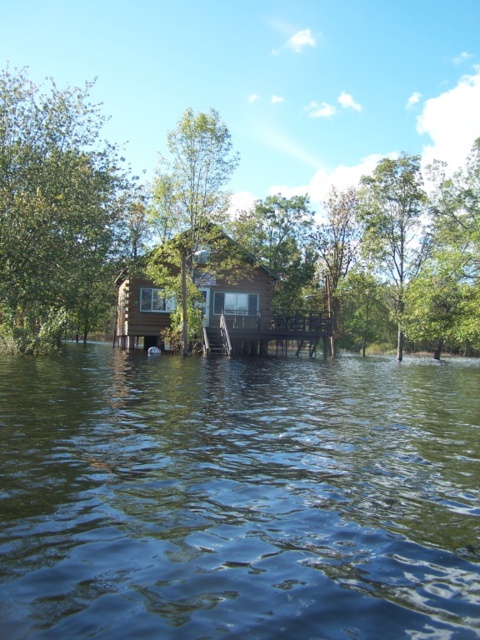
Does point (373, 579) come farther from viewer compared to point (21, 225)?

No, (373, 579) is in front of (21, 225).

In the scene shown: Can you confirm if green water at center is shorter than green wood tree at center?

Indeed, green water at center has a lesser height compared to green wood tree at center.

Is point (145, 566) closer to camera compared to point (377, 244)?

Yes.

This screenshot has width=480, height=640. Identify the location of green water at center. (238, 497).

Locate an element on the screen. green matte tree at center is located at coordinates (192, 179).

Does green matte tree at center have a lesser height compared to green leafy tree at upper right?

In fact, green matte tree at center may be taller than green leafy tree at upper right.

You are a GUI agent. You are given a task and a screenshot of the screen. Output one action in this format:
    pyautogui.click(x=<x>, y=<y>)
    Task: Click on the green matte tree at center
    The height and width of the screenshot is (640, 480).
    Given the screenshot: What is the action you would take?
    [192, 179]

Measure the distance from brown wooden cabin at center to green matte tree at center.

brown wooden cabin at center is 4.42 meters away from green matte tree at center.

Between brown wooden cabin at center and green matte tree at center, which one appears on the left side from the viewer's perspective?

Positioned to the left is brown wooden cabin at center.

Describe the element at coordinates (190, 288) in the screenshot. I see `brown wooden cabin at center` at that location.

Image resolution: width=480 pixels, height=640 pixels. What are the coordinates of `brown wooden cabin at center` in the screenshot? It's located at (190, 288).